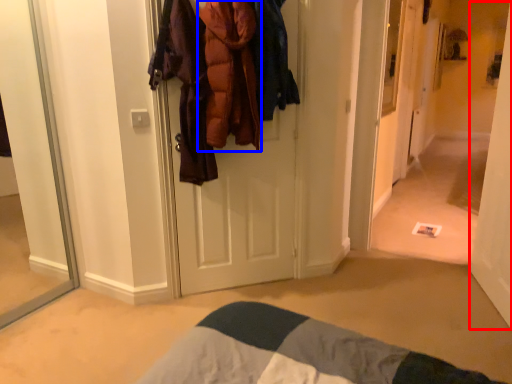
Question: Among these objects, which one is nearest to the camera, door (highlighted by a red box) or clothing (highlighted by a blue box)?

Choices:
 (A) door
 (B) clothing

Answer: (A)